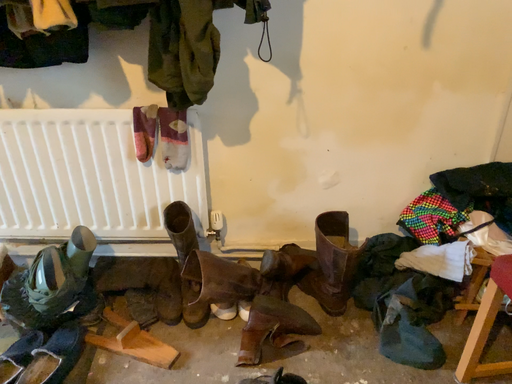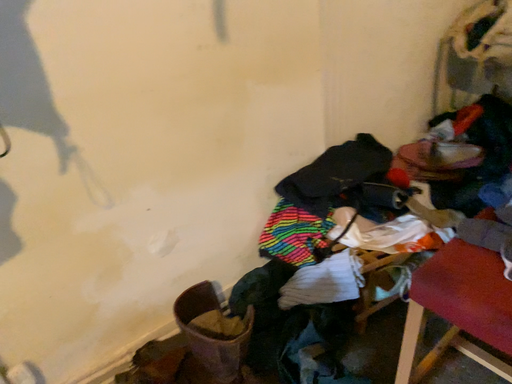
Question: How did the camera likely rotate when shooting the video?

Choices:
 (A) rotated left
 (B) rotated right

Answer: (B)